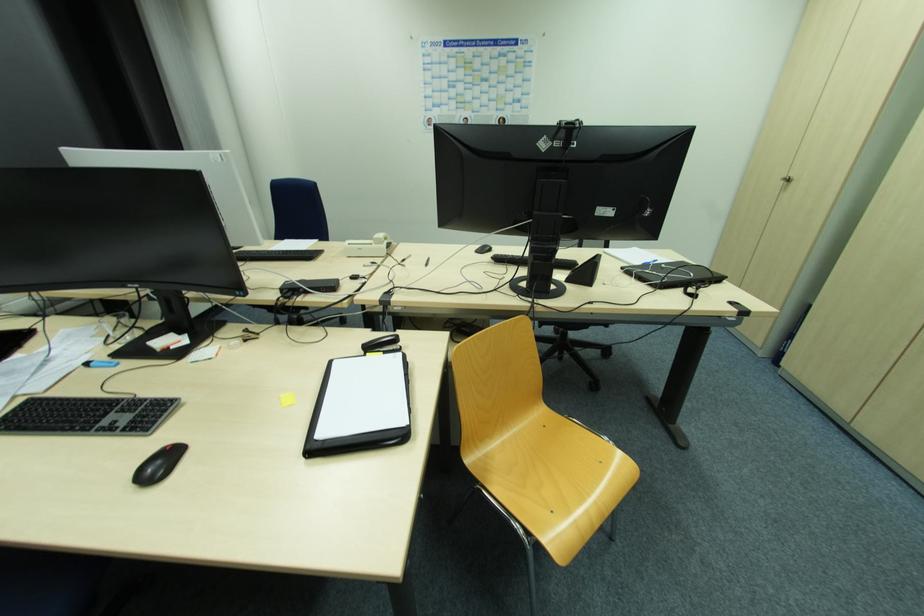
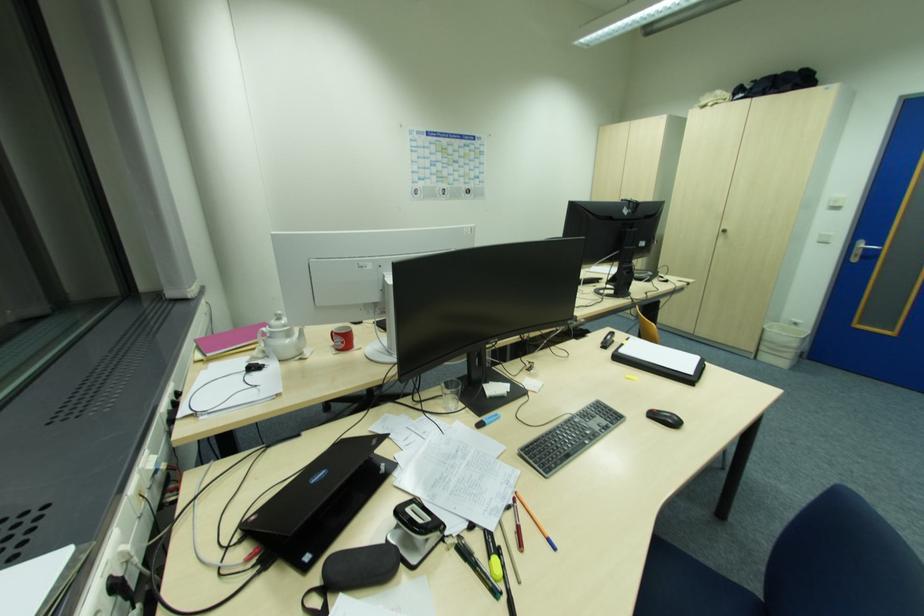
The point at (397, 341) is marked in the first image. Where is the corresponding point in the second image?

(614, 336)